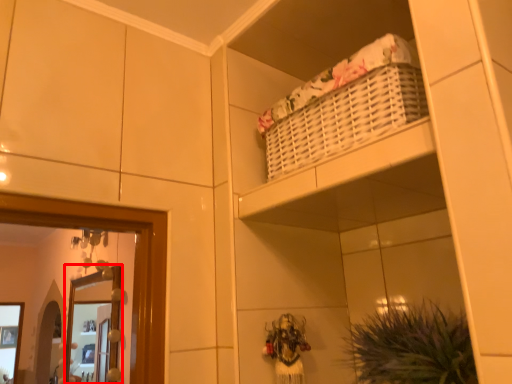
Question: Observing the image, what is the correct spatial positioning of mirror (annotated by the red box) in reference to plant?

Choices:
 (A) left
 (B) right

Answer: (A)